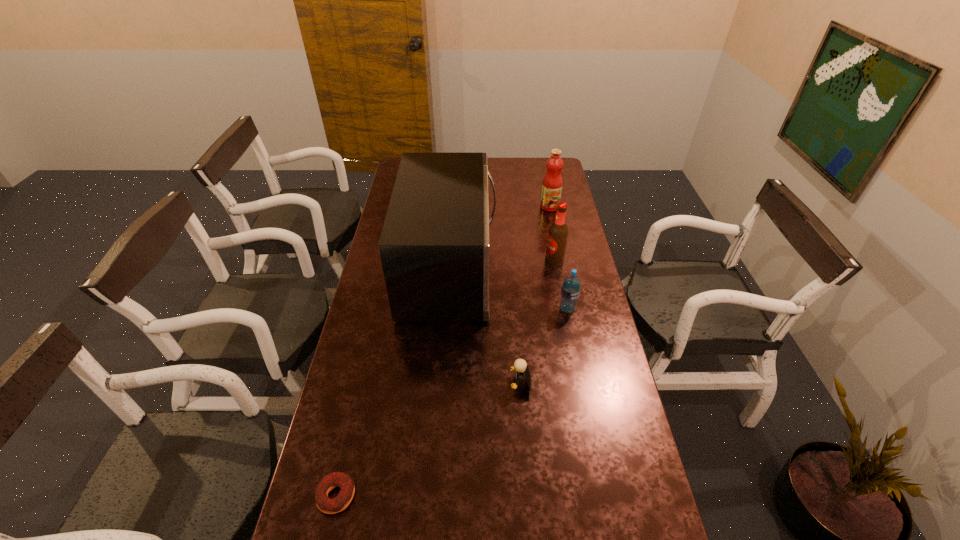
Find the location of `beer bottle positioned at the right edge`. beer bottle positioned at the right edge is located at coordinates (558, 231).

I want to click on water bottle located at the right edge, so click(x=570, y=291).

Locate an element on the screen. The image size is (960, 540). free region at the far edge of the desktop is located at coordinates (490, 180).

Locate an element on the screen. free location at the left edge is located at coordinates (369, 436).

Identify the location of vacant space at the right edge of the desktop. (573, 366).

Locate an element on the screen. The height and width of the screenshot is (540, 960). vacant area that lies between the beer bottle and the water bottle is located at coordinates (561, 285).

Find the location of a particular element. free spot between the fruit juice and the fifth farthest object is located at coordinates (535, 295).

This screenshot has height=540, width=960. I want to click on empty space between the tallest object and the shortest object, so click(393, 382).

Where is `vacant space in between the beer bottle and the second object from left to right`? The height and width of the screenshot is (540, 960). vacant space in between the beer bottle and the second object from left to right is located at coordinates (502, 265).

Identify the location of free area in between the water bottle and the microwave oven. (509, 289).